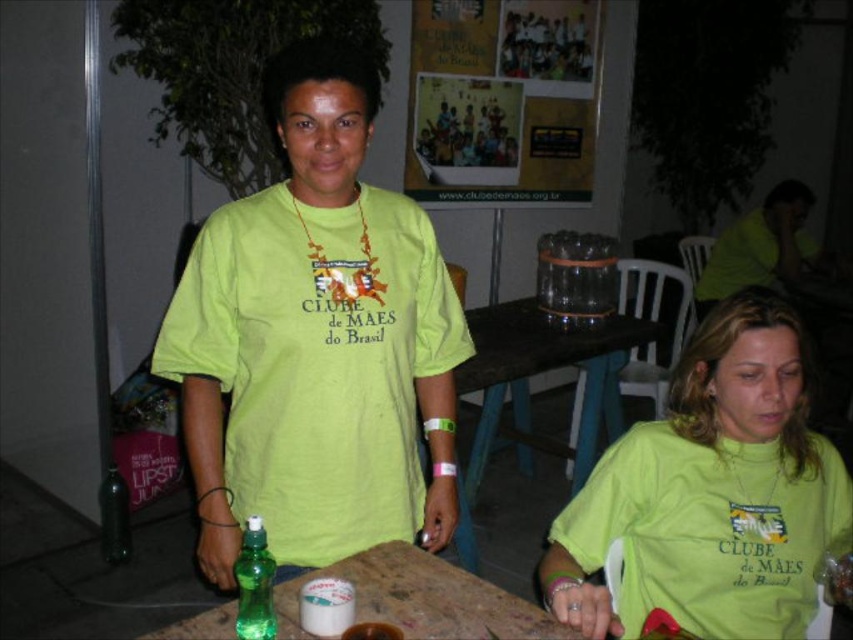
Question: Among these objects, which one is nearest to the camera?

Choices:
 (A) matte green shirt at upper right
 (B) green plastic bottle at lower left
 (C) green matte t-shirt at center
 (D) wooden table at center

Answer: (C)

Question: Which point is closer to the camera?

Choices:
 (A) (801, 227)
 (B) (115, 476)
 (C) (253, 608)

Answer: (C)

Question: Does wooden table at center have a larger size compared to translucent plastic table at center?

Choices:
 (A) yes
 (B) no

Answer: (A)

Question: From the image, what is the correct spatial relationship of translucent plastic table at center in relation to matte green shirt at upper right?

Choices:
 (A) below
 (B) above

Answer: (A)

Question: Which of these objects is positioned closest to the green matte spray bottle at center?

Choices:
 (A) translucent plastic table at center
 (B) matte green shirt at upper right
 (C) green matte t-shirt at center

Answer: (A)

Question: Is translucent plastic table at center closer to the viewer compared to green plastic bottle at lower left?

Choices:
 (A) no
 (B) yes

Answer: (B)